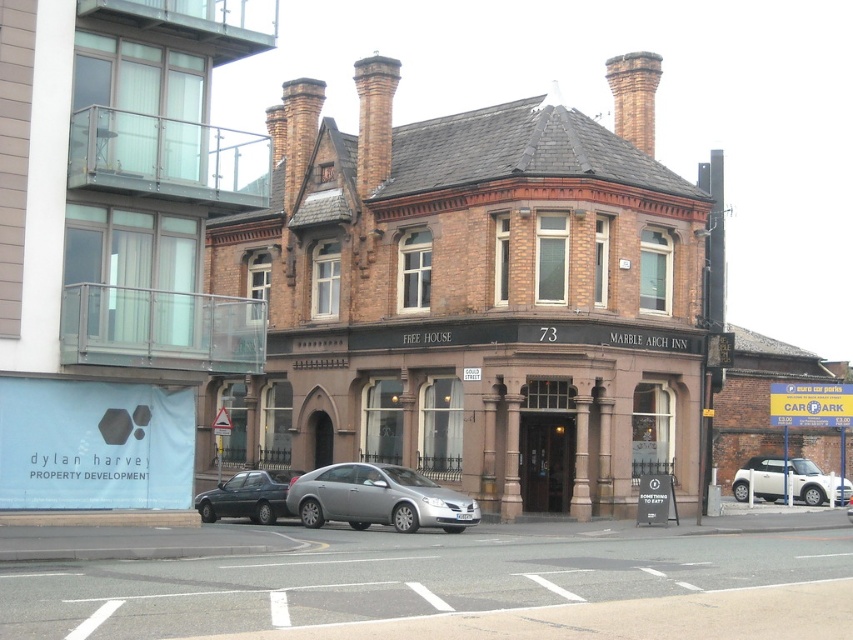
You are driving a car and want to park it near the Victorian building. The smooth asphalt road at lower center and the white matte car at lower right are in your view. Which direction should you drive to reach the road first?

You should drive to the left because the smooth asphalt road at lower center is located to the left of the white matte car at lower right, so it will be reached first by moving in that direction.

You are standing at the entrance of the brown brick building at center. If you walk straight ahead, will you face the modern glass and steel structure to the left of the building?

The brown brick building at center is positioned at point (474, 296), so walking straight ahead from the entrance would not face the modern glass and steel structure to the left of the building since the structure is located to the left side of the building.